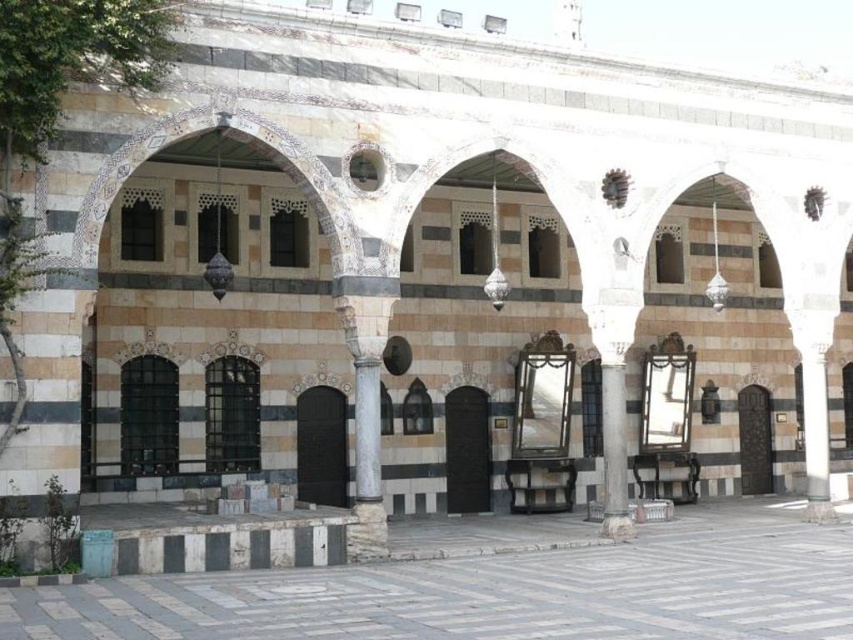
Is point (686, 634) less distant than point (613, 483)?

Yes.

Is marble tiles at center shorter than smooth gray column at center?

Indeed, marble tiles at center has a lesser height compared to smooth gray column at center.

The height and width of the screenshot is (640, 853). What do you see at coordinates (496, 592) in the screenshot?
I see `marble tiles at center` at bounding box center [496, 592].

At what (x,y) coordinates should I click in order to perform the action: click on marble tiles at center. Please return your answer as a coordinate pair (x, y). The height and width of the screenshot is (640, 853). Looking at the image, I should click on (496, 592).